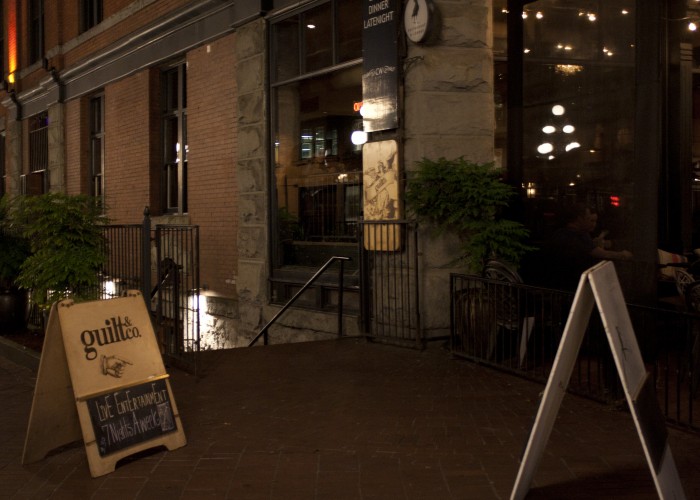
This screenshot has height=500, width=700. In order to click on light in this screenshot , I will do [x=358, y=138].